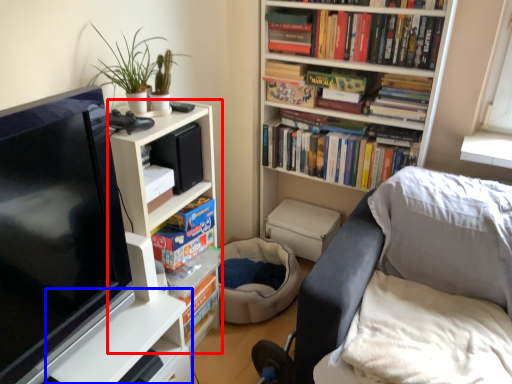
Question: Among these objects, which one is farthest to the camera, bookcase (highlighted by a red box) or table (highlighted by a blue box)?

Choices:
 (A) bookcase
 (B) table

Answer: (A)